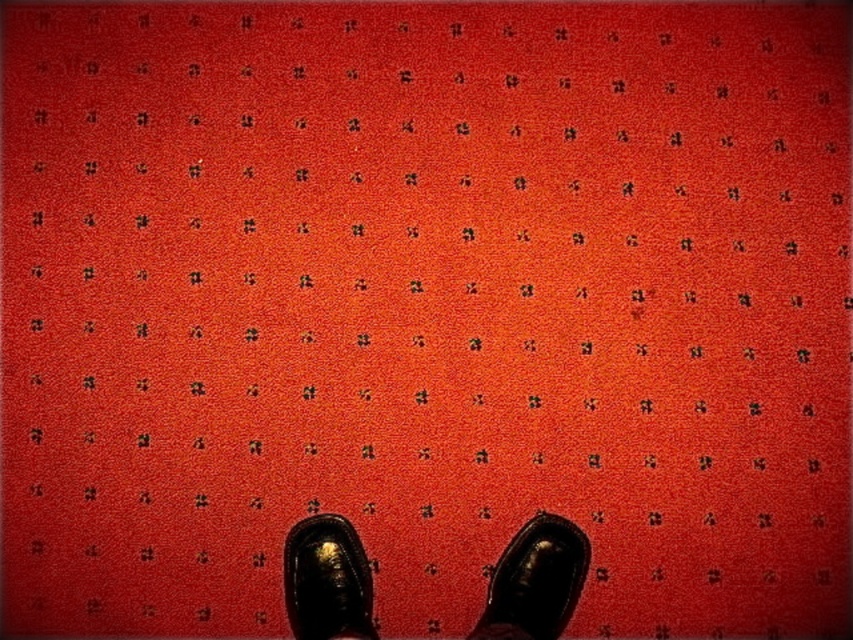
You are taking a photo of the black leather shoes on the carpet and want to focus on the point closer to the camera. Which coordinate should you choose between point (538, 576) and point (305, 604)?

Point (538, 576) is further to the camera than point (305, 604), so you should choose point (538, 576) to focus on the closer point.

You are a photographer adjusting the lighting to capture the texture of the shiny black shoe at center and the shiny black shoe at lower center. Which shoe will cast a shadow on the other?

The shiny black shoe at center is positioned under the shiny black shoe at lower center, so it will cast a shadow on the one below it.